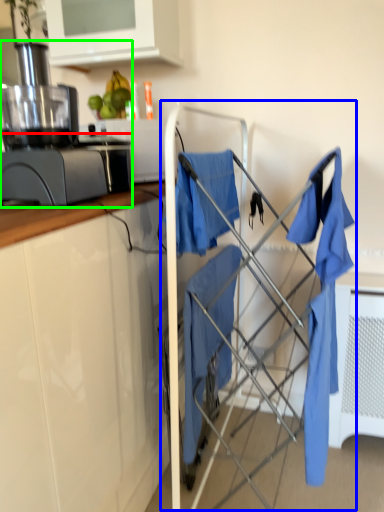
Question: Which object is positioned farthest from kitchen appliance (highlighted by a red box)? Select from baby carriage (highlighted by a blue box) and home appliance (highlighted by a green box).

Choices:
 (A) baby carriage
 (B) home appliance

Answer: (A)